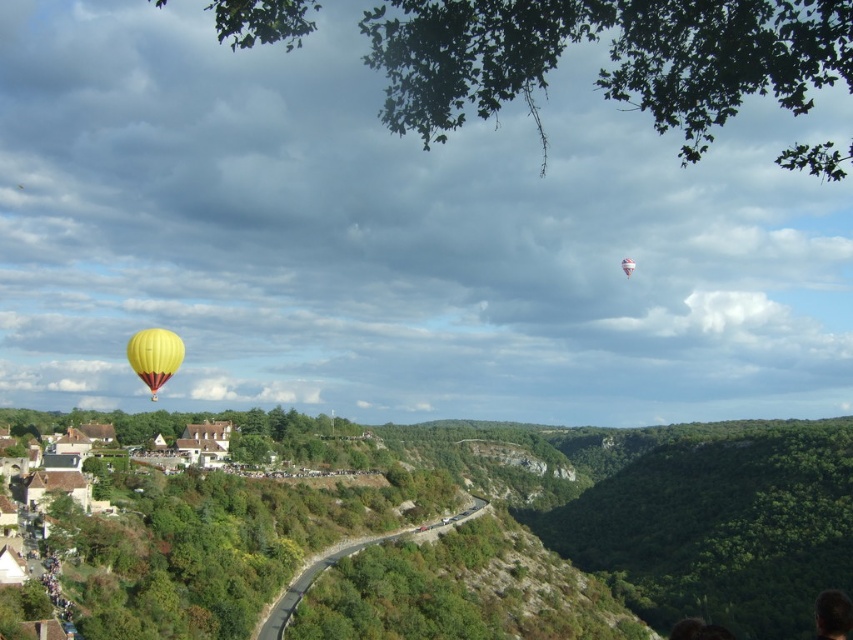
Question: Among these points, which one is nearest to the camera?

Choices:
 (A) (167, 356)
 (B) (631, 264)

Answer: (A)

Question: Is yellow fabric balloon at lower left further to camera compared to yellow fabric hot air balloon at upper left?

Choices:
 (A) yes
 (B) no

Answer: (B)

Question: Is yellow fabric balloon at lower left closer to the viewer compared to yellow fabric hot air balloon at upper left?

Choices:
 (A) yes
 (B) no

Answer: (A)

Question: Does yellow fabric balloon at lower left have a greater width compared to yellow fabric hot air balloon at upper left?

Choices:
 (A) no
 (B) yes

Answer: (A)